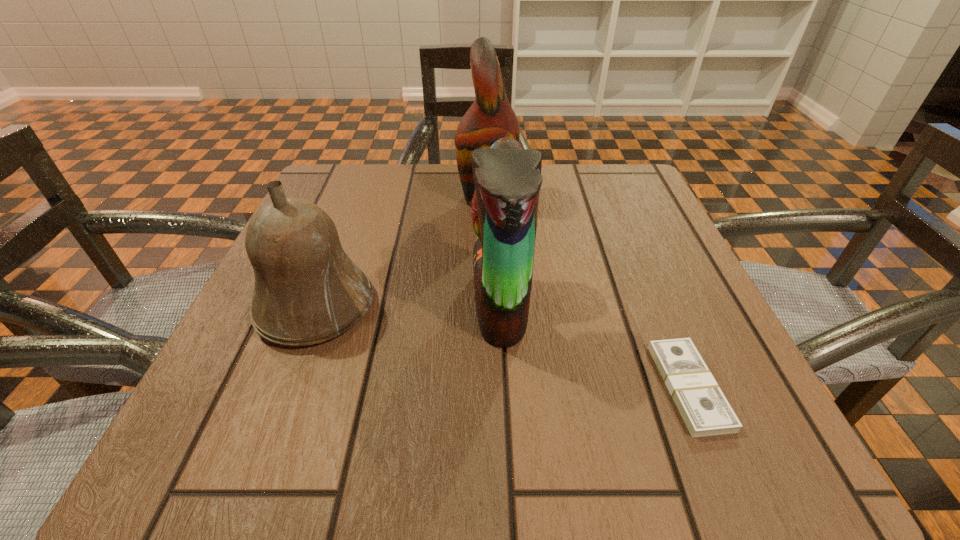
Image resolution: width=960 pixels, height=540 pixels. I want to click on free spot located 0.260m at the face of the shorter parrot, so click(x=314, y=303).

The height and width of the screenshot is (540, 960). What are the coordinates of `vacant region located at the face of the shorter parrot` in the screenshot? It's located at (265, 303).

I want to click on vacant space located at the face of the shorter parrot, so click(411, 303).

You are a GUI agent. You are given a task and a screenshot of the screen. Output one action in this format:
    pyautogui.click(x=<x>, y=<y>)
    Task: Click on the free point located on the back of the leftmost object
    The width and height of the screenshot is (960, 540).
    Given the screenshot: What is the action you would take?
    pyautogui.click(x=343, y=235)

Identify the location of vacant space located 0.140m on the left of the rightmost object. This screenshot has height=540, width=960. 560,387.

Identify the location of object at the far edge. The height and width of the screenshot is (540, 960). (491, 117).

At what (x,y) coordinates should I click in order to perform the action: click on object at the near edge. Please return your answer as a coordinate pair (x, y). Looking at the image, I should click on click(703, 407).

Where is `object present at the left edge`? object present at the left edge is located at coordinates (307, 290).

Where is `object that is at the right edge`? The height and width of the screenshot is (540, 960). object that is at the right edge is located at coordinates (703, 407).

What are the coordinates of `object positioned at the near right corner` in the screenshot? It's located at (703, 407).